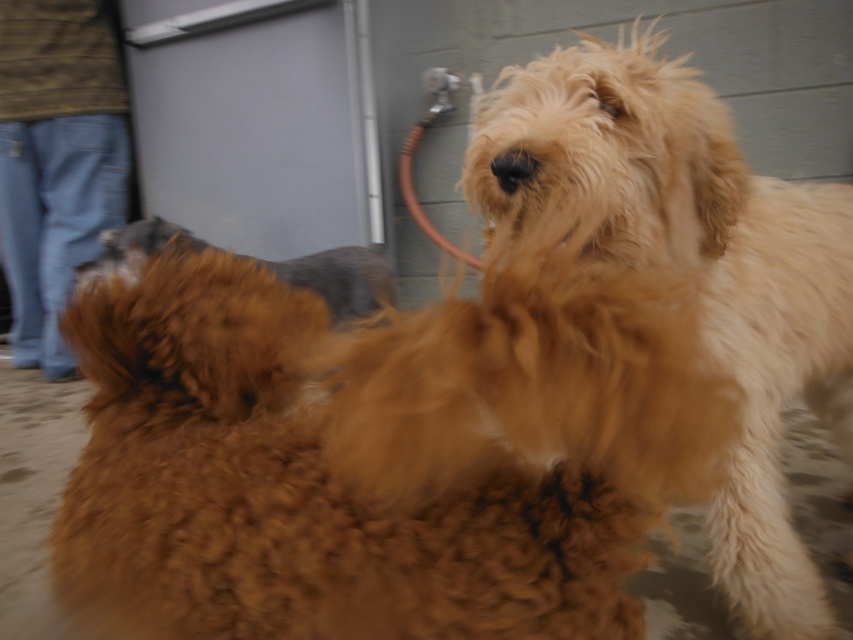
Does point (688, 225) lie behind point (322, 289)?

No, (688, 225) is in front of (322, 289).

Is fluffy golden dog at center further to the viewer compared to brown fluffy dog at center?

No.

You are a GUI agent. You are given a task and a screenshot of the screen. Output one action in this format:
    pyautogui.click(x=<x>, y=<y>)
    Task: Click on the fluffy golden dog at center
    
    Given the screenshot: What is the action you would take?
    pyautogui.click(x=701, y=268)